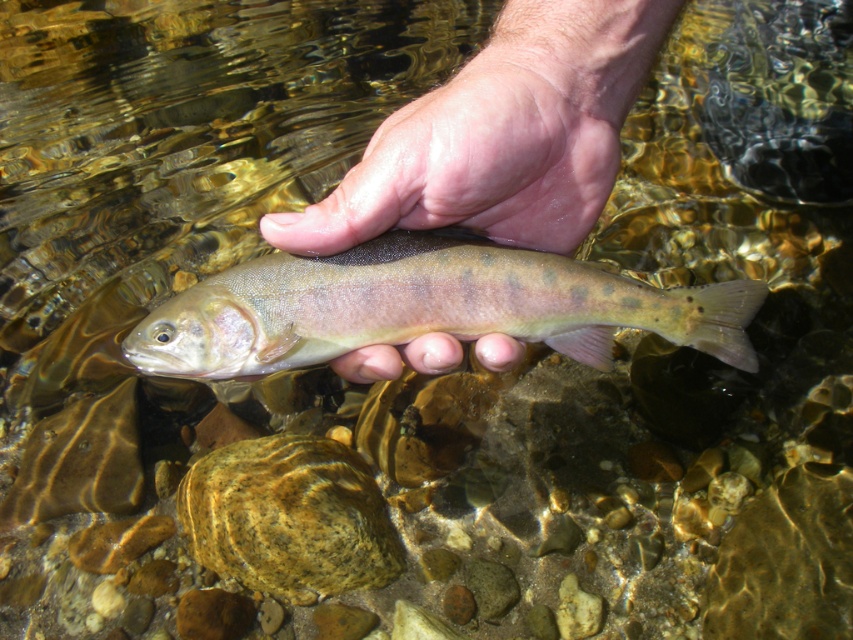
Looking at this image, you are a nature photographer trying to capture the reflection of the shiny silver fish at center in the water. Since the smooth skin hand at center is currently blocking the view, can you move your hand to a position where both the fish and its reflection are visible?

The smooth skin hand at center is above the shiny silver fish at center, so moving the hand aside would allow the reflection of the shiny silver fish at center to be seen in the water.

You are a photographer trying to capture the fish in the stream. You notice the smooth skin hand at center and the shiny silver fish at center. Which object is positioned to the left when you look at the scene?

The shiny silver fish at center is positioned to the left of the smooth skin hand at center.